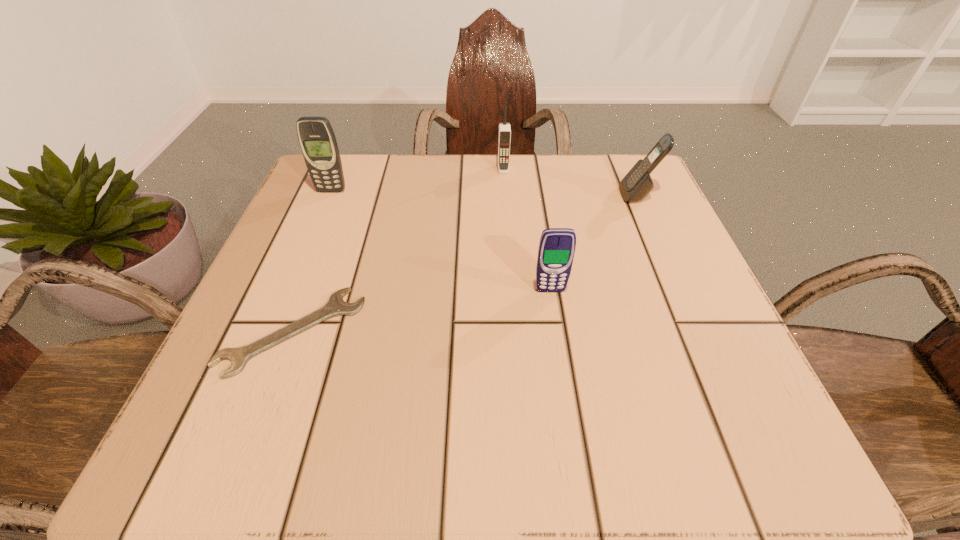
I want to click on free space located on the front-facing side of the rightmost cellular telephone, so click(573, 195).

At what (x,y) coordinates should I click in order to perform the action: click on free space located 0.350m on the front-facing side of the rightmost cellular telephone. Please return your answer as a coordinate pair (x, y). This screenshot has height=540, width=960. Looking at the image, I should click on (452, 195).

This screenshot has height=540, width=960. In order to click on free space located on the front-facing side of the third cellular telephone from left to right in this screenshot , I will do `click(568, 405)`.

The image size is (960, 540). I want to click on blank space located on the front of the shortest object, so click(x=248, y=451).

The width and height of the screenshot is (960, 540). Identify the location of cellular telephone that is at the left edge. (317, 140).

Where is `wrench positioned at the left edge`? This screenshot has height=540, width=960. wrench positioned at the left edge is located at coordinates (335, 306).

Locate an element on the screen. object that is at the right edge is located at coordinates (637, 184).

The image size is (960, 540). In order to click on object at the far left corner in this screenshot , I will do `click(317, 140)`.

This screenshot has height=540, width=960. Find the location of `object positioned at the far right corner`. object positioned at the far right corner is located at coordinates (637, 184).

You are a GUI agent. You are given a task and a screenshot of the screen. Output one action in this format:
    pyautogui.click(x=<x>, y=<y>)
    Task: Click on the free space at the far edge of the desktop
    The width and height of the screenshot is (960, 540).
    Given the screenshot: What is the action you would take?
    pyautogui.click(x=449, y=168)